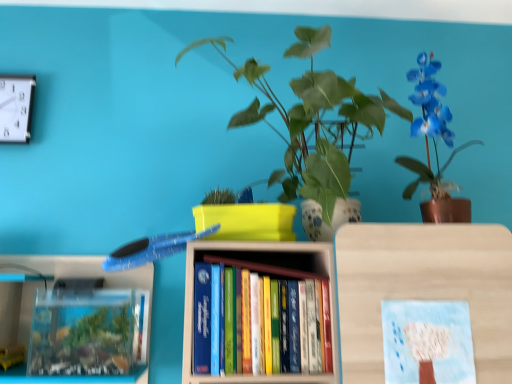
Question: Is pastel blue paper at center oriented towards blue glossy orchid at upper right?

Choices:
 (A) no
 (B) yes

Answer: (A)

Question: Is pastel blue paper at center outside of blue glossy orchid at upper right?

Choices:
 (A) yes
 (B) no

Answer: (A)

Question: Is pastel blue paper at center to the left of blue glossy orchid at upper right from the viewer's perspective?

Choices:
 (A) no
 (B) yes

Answer: (B)

Question: Are pastel blue paper at center and blue glossy orchid at upper right far apart?

Choices:
 (A) no
 (B) yes

Answer: (A)

Question: From the image's perspective, is pastel blue paper at center under blue glossy orchid at upper right?

Choices:
 (A) no
 (B) yes

Answer: (B)

Question: Visually, is green leafy plant at upper center positioned to the left or to the right of white plastic clock at upper left?

Choices:
 (A) right
 (B) left

Answer: (A)

Question: Considering the positions of green leafy plant at upper center and white plastic clock at upper left in the image, is green leafy plant at upper center taller or shorter than white plastic clock at upper left?

Choices:
 (A) short
 (B) tall

Answer: (B)

Question: From a real-world perspective, is green leafy plant at upper center positioned above or below white plastic clock at upper left?

Choices:
 (A) above
 (B) below

Answer: (B)

Question: In the image, is green leafy plant at upper center positioned in front of or behind white plastic clock at upper left?

Choices:
 (A) behind
 (B) front

Answer: (B)

Question: Is point (202, 258) positioned closer to the camera than point (497, 82)?

Choices:
 (A) closer
 (B) farther

Answer: (A)

Question: From the image's perspective, relative to green leafy plant at upper center, is hardcover books at center above or below?

Choices:
 (A) below
 (B) above

Answer: (A)

Question: Considering the positions of hardcover books at center and green leafy plant at upper center in the image, is hardcover books at center taller or shorter than green leafy plant at upper center?

Choices:
 (A) tall
 (B) short

Answer: (B)

Question: Is hardcover books at center inside the boundaries of green leafy plant at upper center, or outside?

Choices:
 (A) inside
 (B) outside

Answer: (B)

Question: Choose the correct answer: Is green leafy plant at upper center inside blue glossy orchid at upper right or outside it?

Choices:
 (A) outside
 (B) inside

Answer: (A)

Question: Considering their positions, is green leafy plant at upper center located in front of or behind blue glossy orchid at upper right?

Choices:
 (A) behind
 (B) front

Answer: (B)